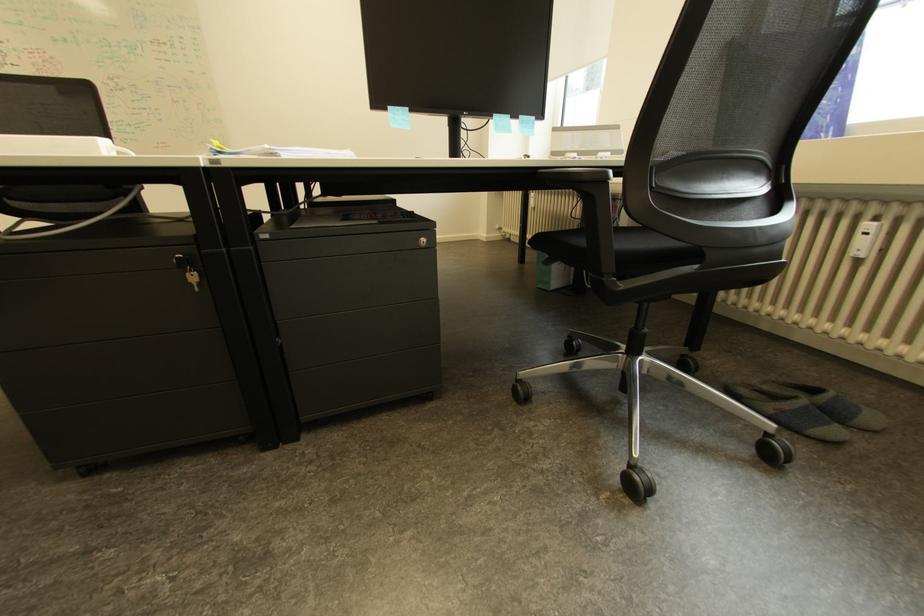
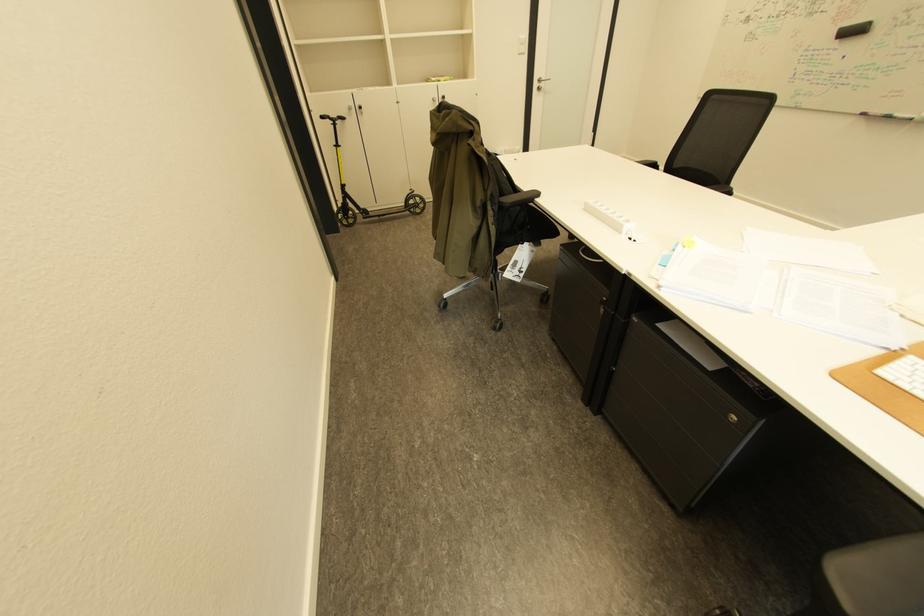
How did the camera likely rotate?

The camera's rotation is toward left-down.